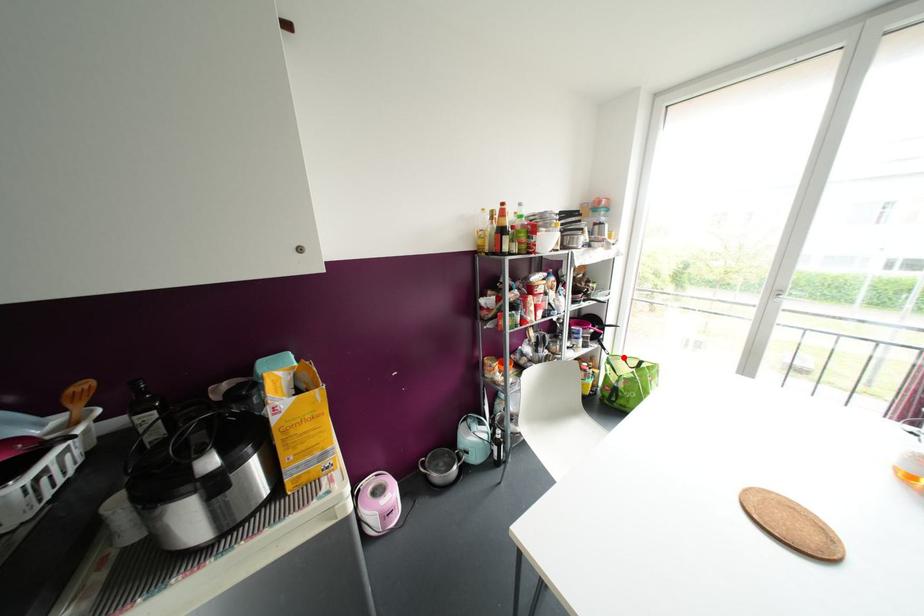
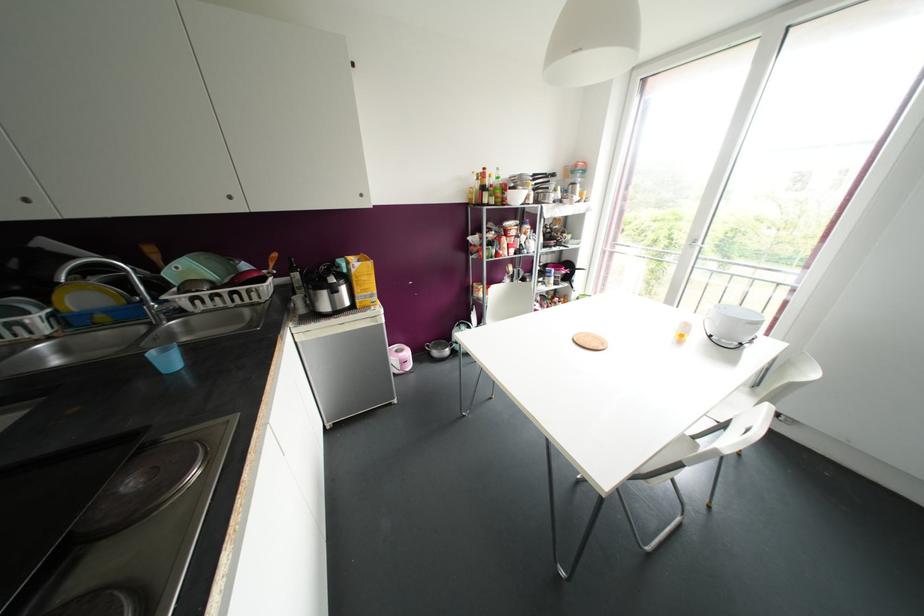
Question: I am providing you with two images of the same scene from different viewpoints. A red point is marked on the first image. Can you still see the location of the red point in image 2?

Choices:
 (A) Yes
 (B) No

Answer: (B)